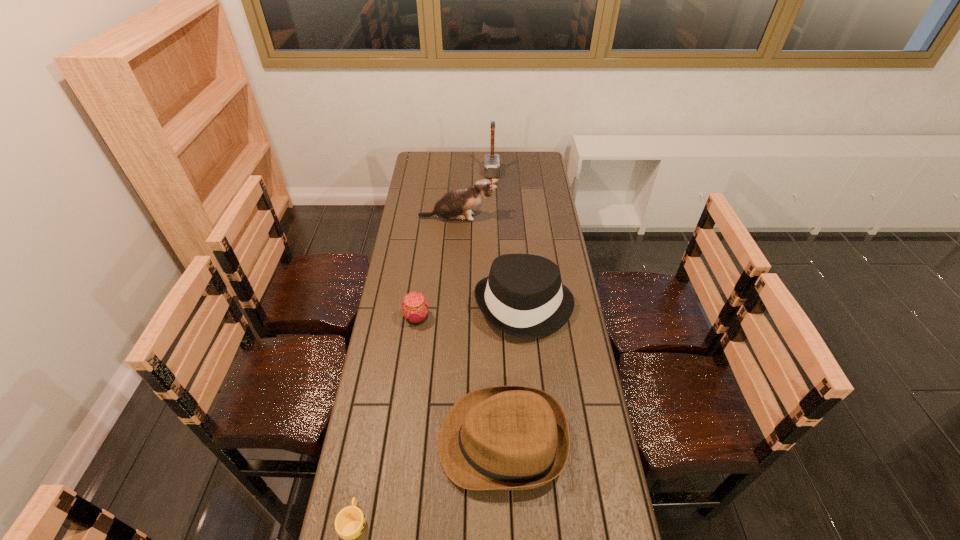
At what (x,y) coordinates should I click in order to perform the action: click on vacant region that satisfies the following two spatial constraints: 1. on the front side of the farther fedora; 2. on the front-facing side of the shorter fedora. Please return your answer as a coordinate pair (x, y). Looking at the image, I should click on coord(538,442).

This screenshot has height=540, width=960. What are the coordinates of `vacant area in the image that satisfies the following two spatial constraints: 1. at the face of the farther fedora; 2. on the right side of the second farthest object` in the screenshot? It's located at (453, 307).

Locate an element on the screen. vacant region that satisfies the following two spatial constraints: 1. on the back side of the taller fedora; 2. at the face of the cat is located at coordinates (516, 218).